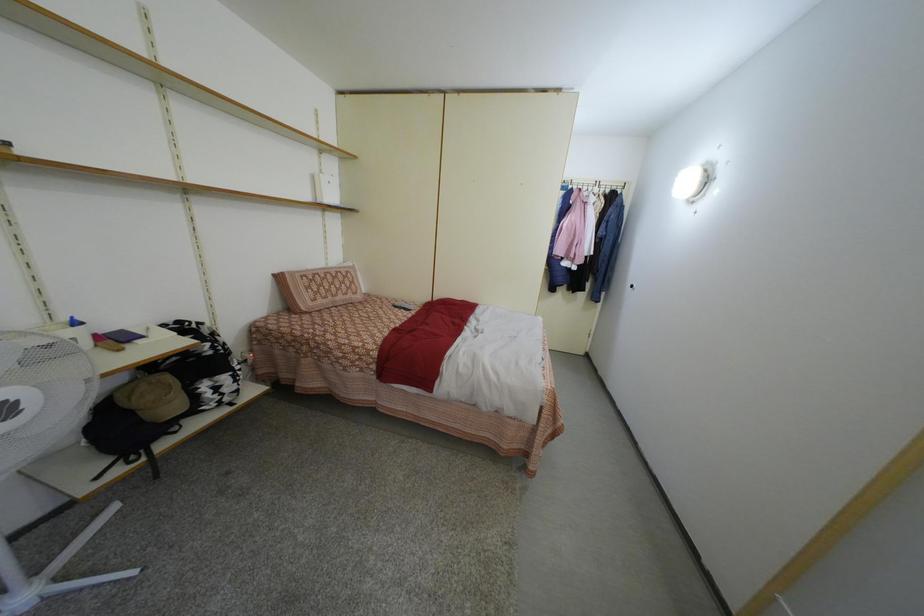
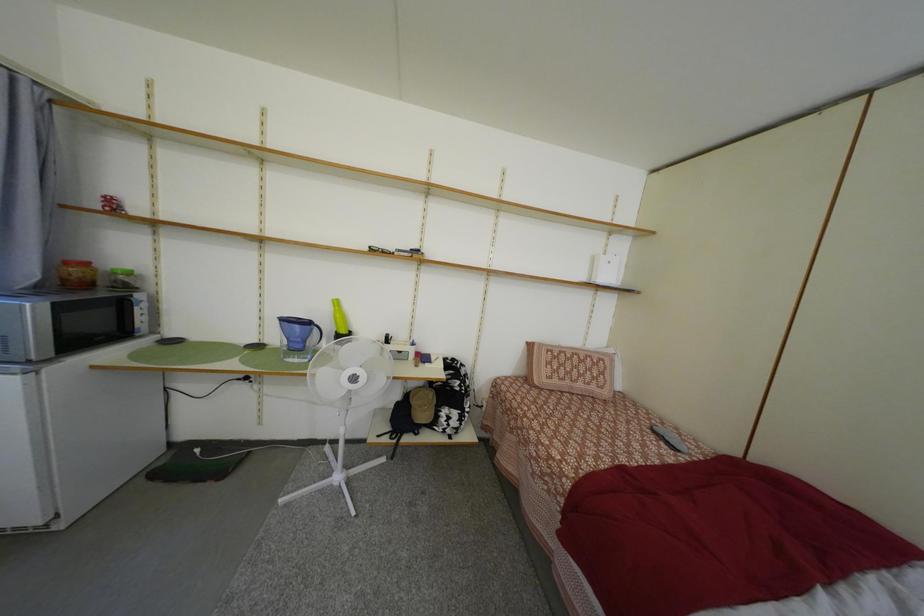
Question: The camera is either moving clockwise (left) or counter-clockwise (right) around the object. The first image is from the beginning of the video and the second image is from the end. Is the camera moving left or right when shooting the video?

Choices:
 (A) Left
 (B) Right

Answer: (B)